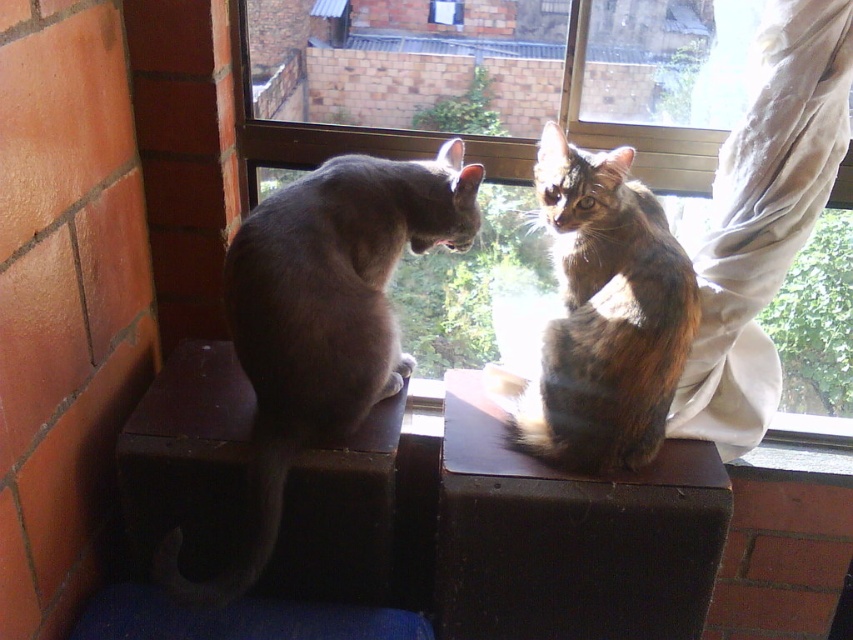
What do you see at coordinates (322, 320) in the screenshot? I see `gray fur cat at left` at bounding box center [322, 320].

In the scene shown: Is gray fur cat at left smaller than tabby fur cat at center?

No, gray fur cat at left is not smaller than tabby fur cat at center.

Locate an element on the screen. gray fur cat at left is located at coordinates (322, 320).

This screenshot has width=853, height=640. Identify the location of gray fur cat at left. (322, 320).

Is transparent glass window at center positioned behind gray fur cat at left?

No.

Consider the image. Does transparent glass window at center have a greater width compared to gray fur cat at left?

Indeed, transparent glass window at center has a greater width compared to gray fur cat at left.

Where is `transparent glass window at center`? This screenshot has height=640, width=853. transparent glass window at center is located at coordinates (746, 196).

What do you see at coordinates (746, 196) in the screenshot? This screenshot has height=640, width=853. I see `transparent glass window at center` at bounding box center [746, 196].

Which is in front, point (799, 67) or point (583, 330)?

Point (799, 67) is more forward.

Where is `transparent glass window at center`? The height and width of the screenshot is (640, 853). transparent glass window at center is located at coordinates (746, 196).